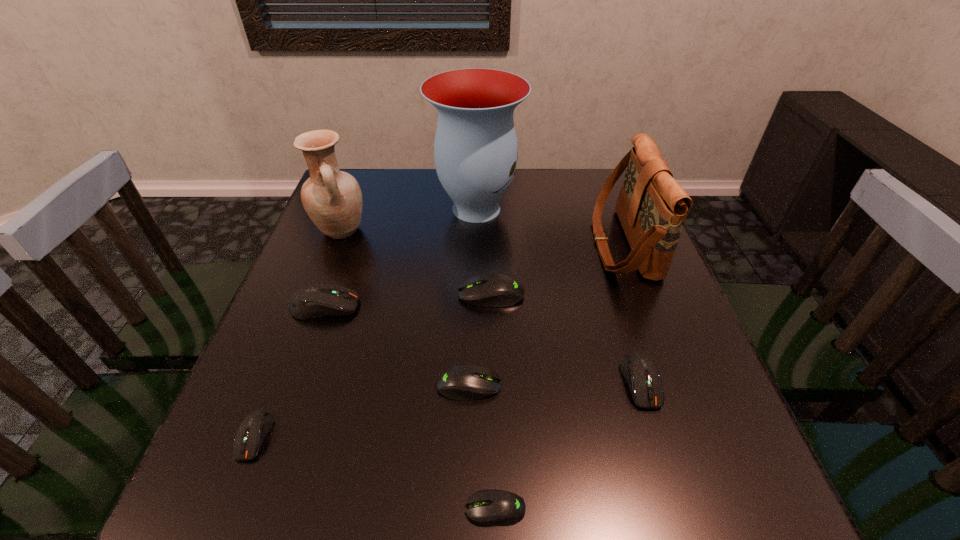
At what (x,y) coordinates should I click in order to perform the action: click on blank region between the second nearest object and the rightmost dark computer equipment. Please return your answer as a coordinate pair (x, y). Looking at the image, I should click on (447, 409).

Where is `object that is the second closest to the shoulder bag`? The width and height of the screenshot is (960, 540). object that is the second closest to the shoulder bag is located at coordinates pyautogui.click(x=640, y=372).

Select which object appears as the closest to the second smallest gray computer mouse. Please provide its 2D coordinates. Your answer should be formatted as a tuple, i.e. [(x, y)], where the tuple contains the x and y coordinates of a point satisfying the conditions above.

[(493, 507)]

The height and width of the screenshot is (540, 960). Identify the location of the fifth closest computer mouse relative to the rightmost dark computer equipment. (252, 431).

Where is `the sixth closest computer mouse to the shoulder bag`? Image resolution: width=960 pixels, height=540 pixels. the sixth closest computer mouse to the shoulder bag is located at coordinates (252, 431).

Select which dark computer equipment appears as the second closest to the biggest dark computer equipment. Please provide its 2D coordinates. Your answer should be formatted as a tuple, i.e. [(x, y)], where the tuple contains the x and y coordinates of a point satisfying the conditions above.

[(640, 372)]

The width and height of the screenshot is (960, 540). Find the location of `dark computer equipment that is the closest to the pink pottery`. dark computer equipment that is the closest to the pink pottery is located at coordinates (317, 300).

Where is `gray computer mouse that is the closest to the second biggest gray computer mouse`? The height and width of the screenshot is (540, 960). gray computer mouse that is the closest to the second biggest gray computer mouse is located at coordinates (493, 507).

Identify which gray computer mouse is the second closest to the farthest dark computer equipment. Please provide its 2D coordinates. Your answer should be formatted as a tuple, i.e. [(x, y)], where the tuple contains the x and y coordinates of a point satisfying the conditions above.

[(465, 382)]

The width and height of the screenshot is (960, 540). I want to click on vacant space that satisfies the following two spatial constraints: 1. on the button of the second smallest dark computer equipment; 2. on the wheel side of the second smallest gray computer mouse, so click(x=642, y=385).